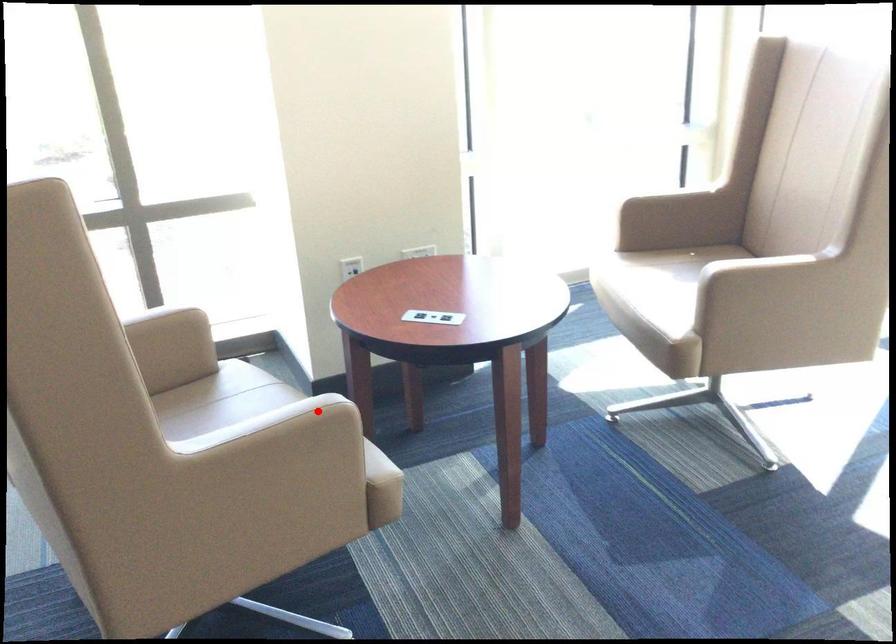
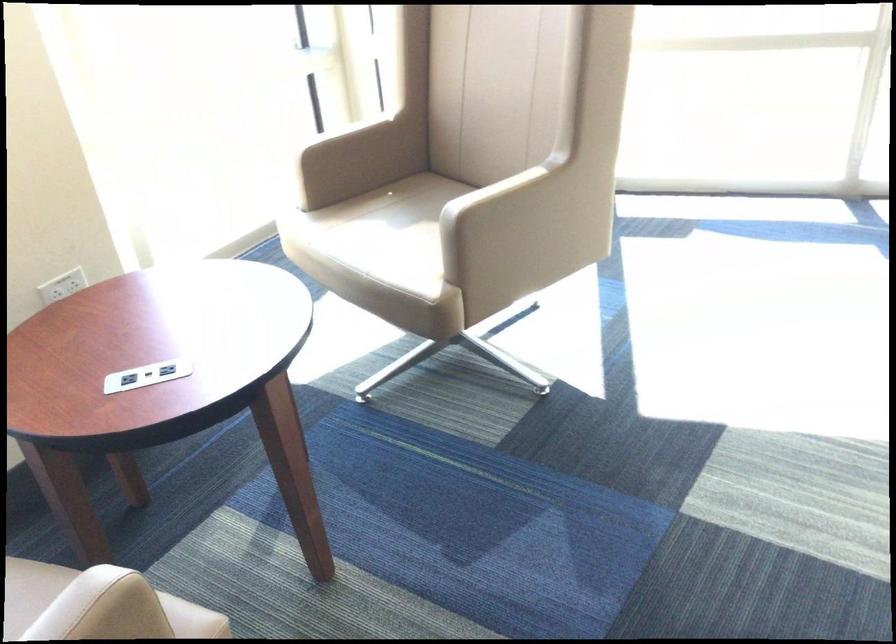
Question: I am providing you with two images of the same scene from different viewpoints. A red point is shown in image1. For the corresponding object point in image2, is it positioned nearer or farther from the camera?

Choices:
 (A) Nearer
 (B) Farther

Answer: (A)